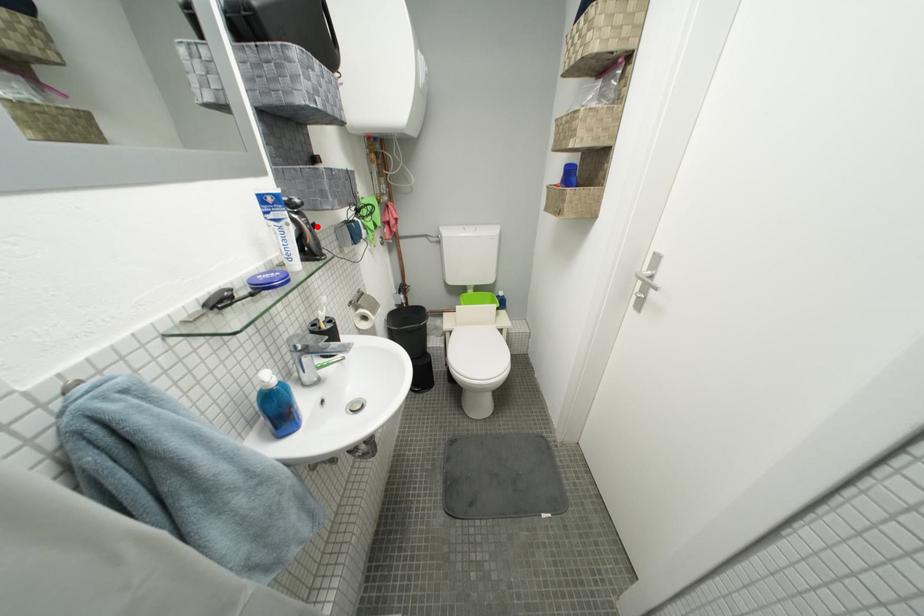
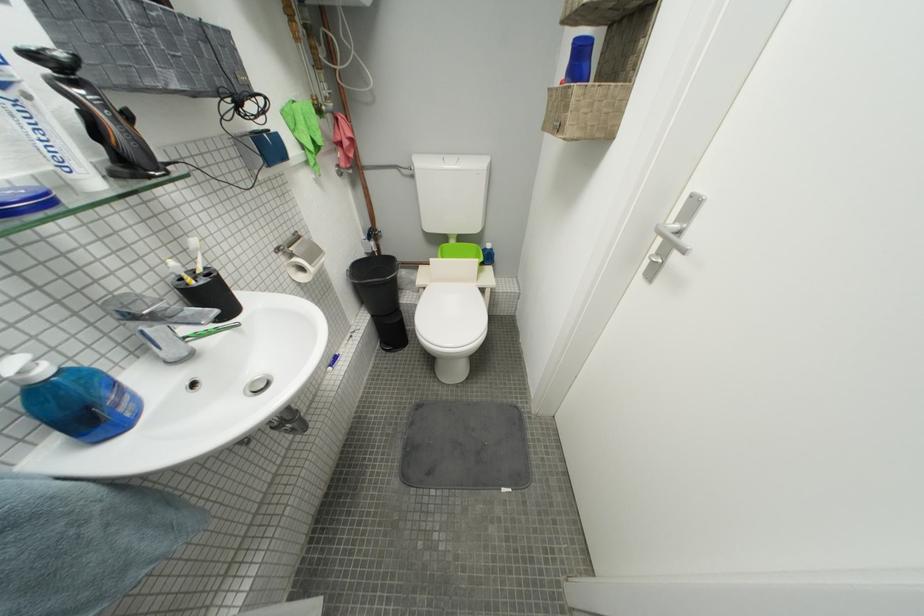
Locate, in the second image, the point that corresponds to the highlighted location in the first image.

(114, 108)